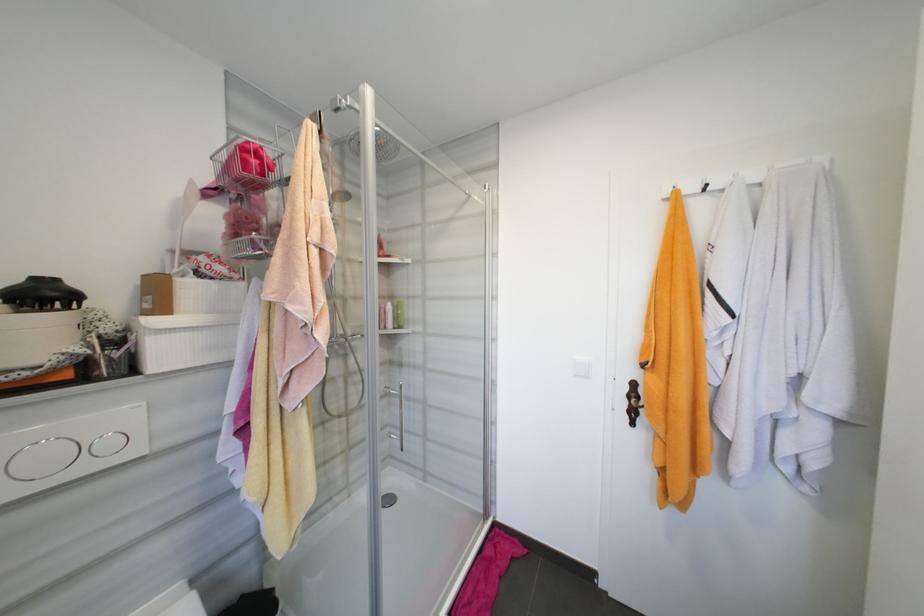
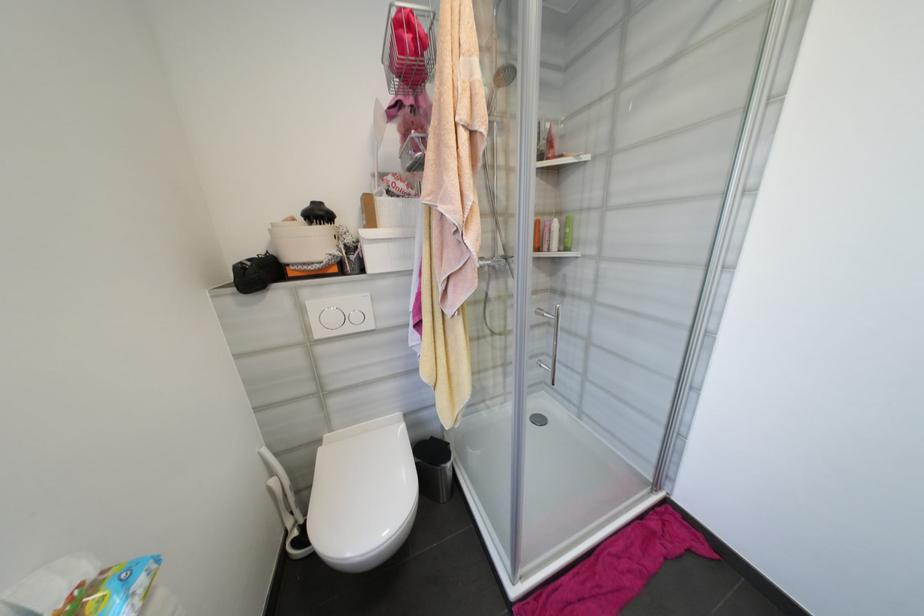
Find the pixel in the second image that matches point 402,326 in the first image.

(567, 249)